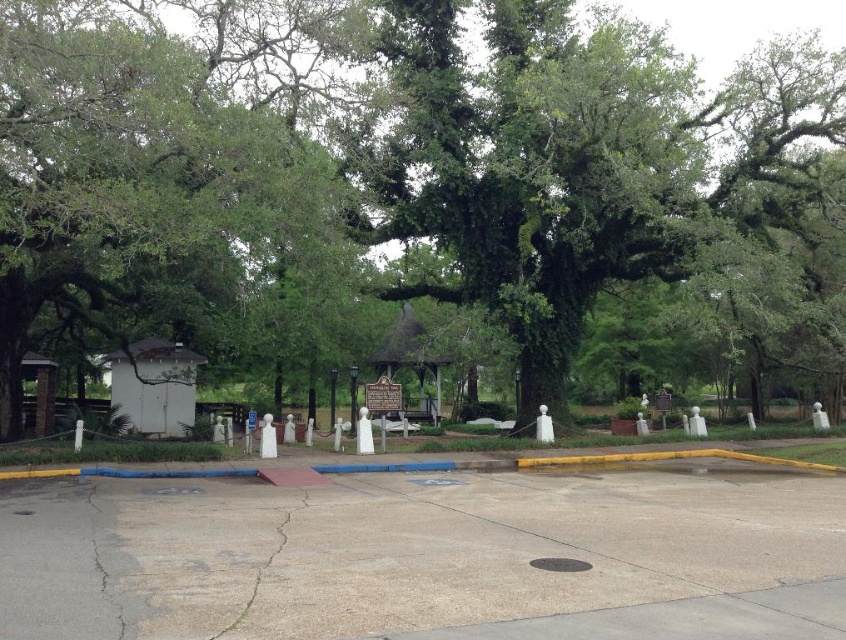
In the scene shown: Does green leafy tree at center have a larger size compared to gray concrete pavement at center?

Yes.

Between green leafy tree at center and gray concrete pavement at center, which one has less height?

gray concrete pavement at center is shorter.

This screenshot has width=846, height=640. What do you see at coordinates (415, 188) in the screenshot? I see `green leafy tree at center` at bounding box center [415, 188].

At what (x,y) coordinates should I click in order to perform the action: click on green leafy tree at center. Please return your answer as a coordinate pair (x, y). The image size is (846, 640). Looking at the image, I should click on (415, 188).